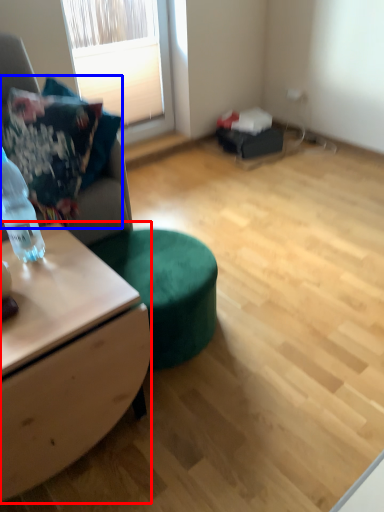
Question: Among these objects, which one is farthest to the camera, desk (highlighted by a red box) or pillow (highlighted by a blue box)?

Choices:
 (A) desk
 (B) pillow

Answer: (B)